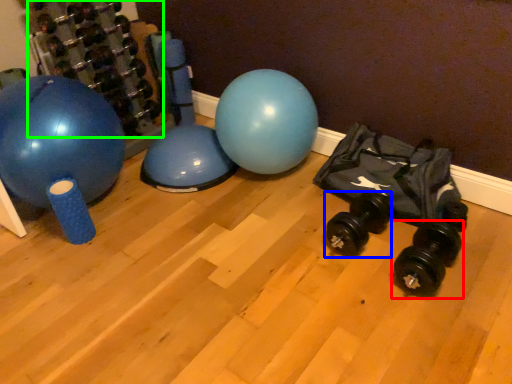
Question: Considering the real-world distances, which object is farthest from dumbbell (highlighted by a red box)? dumbbell (highlighted by a blue box) or dumbbell (highlighted by a green box)?

Choices:
 (A) dumbbell
 (B) dumbbell

Answer: (B)